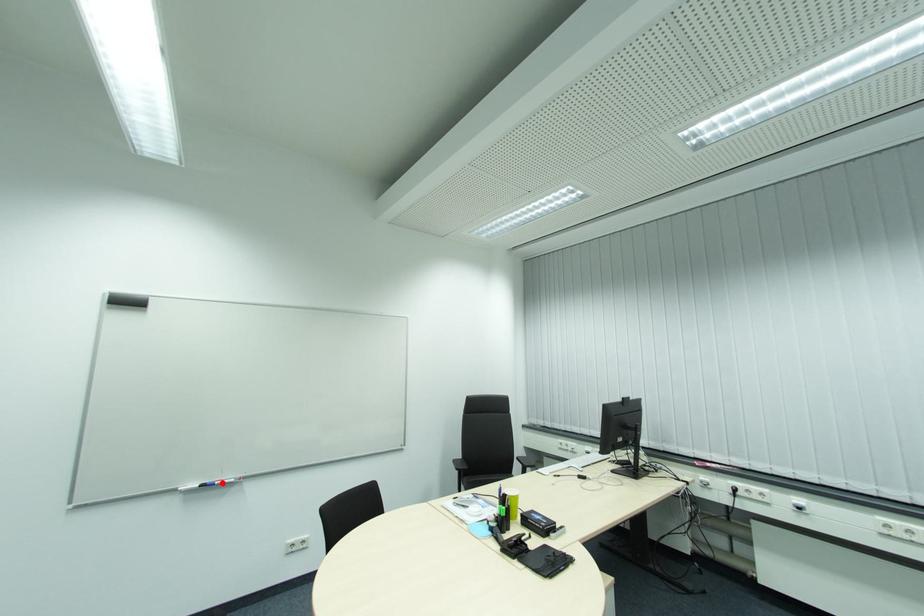
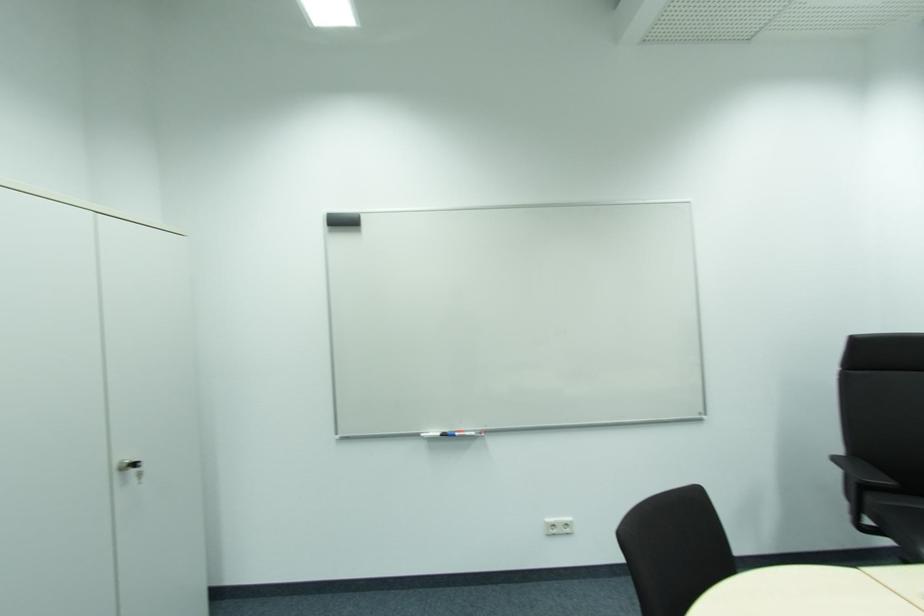
In the second image, find the point that corresponds to the highlighted location in the first image.

(464, 434)